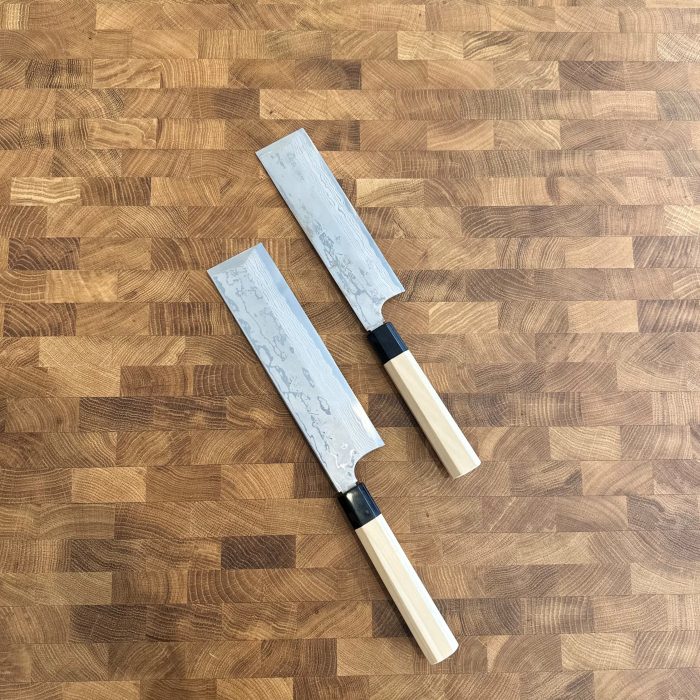
At what (x,y) coordinates should I click in order to perform the action: click on handles. Please return your answer as a coordinate pair (x, y). This screenshot has width=700, height=700. Looking at the image, I should click on (411, 598), (432, 413).